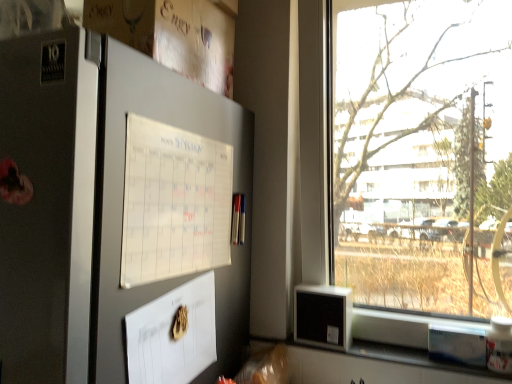
The image size is (512, 384). Describe the element at coordinates (423, 153) in the screenshot. I see `transparent glass window at right` at that location.

Based on the photo, measure the distance between white paper calendar at upper left and camera.

A distance of 27.89 inches exists between white paper calendar at upper left and camera.

The height and width of the screenshot is (384, 512). Describe the element at coordinates (174, 203) in the screenshot. I see `white paper calendar at upper left` at that location.

At what (x,y) coordinates should I click in order to perform the action: click on transparent glass window at right. Please return your answer as a coordinate pair (x, y). This screenshot has width=512, height=384. Looking at the image, I should click on (423, 153).

Would you say transparent glass window at right is outside white paper calendar at upper left?

That's correct, transparent glass window at right is outside of white paper calendar at upper left.

Is transparent glass window at right taller than white paper calendar at upper left?

Correct, transparent glass window at right is much taller as white paper calendar at upper left.

Visually, is transparent glass window at right positioned to the left or to the right of white paper calendar at upper left?

transparent glass window at right is positioned on white paper calendar at upper left's right side.

From the image's perspective, is transparent glass window at right on white paper calendar at upper left?

Correct, transparent glass window at right appears higher than white paper calendar at upper left in the image.

Identify the location of window that is behind the white paper calendar at upper left. (423, 153).

Is white paper calendar at upper left oriented towards transparent glass window at right?

No, white paper calendar at upper left is not aimed at transparent glass window at right.

Between white paper calendar at upper left and transparent glass window at right, which one has smaller width?

white paper calendar at upper left is thinner.

In the scene shown: Considering the relative positions of satin silver fridge at left and white paper calendar at upper left in the image provided, is satin silver fridge at left behind white paper calendar at upper left?

No, it is in front of white paper calendar at upper left.

Considering the sizes of objects satin silver fridge at left and white paper calendar at upper left in the image provided, who is bigger, satin silver fridge at left or white paper calendar at upper left?

satin silver fridge at left is bigger.

Are satin silver fridge at left and white paper calendar at upper left beside each other?

A: Yes, satin silver fridge at left is with white paper calendar at upper left.

From the image's perspective, between satin silver fridge at left and white paper calendar at upper left, who is located below?

satin silver fridge at left is shown below in the image.

Can you confirm if transparent glass window at right is bigger than satin silver fridge at left?

No.

What's the angular difference between transparent glass window at right and satin silver fridge at left's facing directions?

The facing directions of transparent glass window at right and satin silver fridge at left are 0.74 degrees apart.

Consider the image. Visually, is transparent glass window at right positioned to the left or to the right of satin silver fridge at left?

transparent glass window at right is to the right of satin silver fridge at left.

From a real-world perspective, who is located lower, transparent glass window at right or satin silver fridge at left?

satin silver fridge at left.

Considering the sizes of objects white paper calendar at upper left and satin silver fridge at left in the image provided, who is wider, white paper calendar at upper left or satin silver fridge at left?

With larger width is satin silver fridge at left.

From a real-world perspective, which is physically below, white paper calendar at upper left or satin silver fridge at left?

From a 3D spatial view, satin silver fridge at left is below.

Is white paper calendar at upper left shorter than satin silver fridge at left?

Yes.

Can you confirm if satin silver fridge at left is thinner than transparent glass window at right?

No.

Is the surface of satin silver fridge at left in direct contact with transparent glass window at right?

satin silver fridge at left and transparent glass window at right are clearly separated.

Does satin silver fridge at left come behind transparent glass window at right?

No, satin silver fridge at left is closer to the camera.

This screenshot has width=512, height=384. In the image, there is a white paper calendar at upper left. In order to click on window above it (from the image's perspective) in this screenshot , I will do `click(423, 153)`.

At what (x,y) coordinates should I click in order to perform the action: click on poster below the transparent glass window at right (from the image's perspective). Please return your answer as a coordinate pair (x, y). This screenshot has width=512, height=384. Looking at the image, I should click on (174, 203).

Based on their spatial positions, is transparent glass window at right or white paper calendar at upper left further from satin silver fridge at left?

transparent glass window at right is further to satin silver fridge at left.

Based on their spatial positions, is transparent glass window at right or satin silver fridge at left further from white paper calendar at upper left?

Among the two, transparent glass window at right is located further to white paper calendar at upper left.

When comparing their distances from transparent glass window at right, does white paper calendar at upper left or satin silver fridge at left seem further?

Among the two, satin silver fridge at left is located further to transparent glass window at right.

When comparing their distances from transparent glass window at right, does satin silver fridge at left or white paper calendar at upper left seem further?

satin silver fridge at left is further to transparent glass window at right.

Based on the photo, based on their spatial positions, is white paper calendar at upper left or transparent glass window at right further from satin silver fridge at left?

The object further to satin silver fridge at left is transparent glass window at right.

From the image, which object appears to be farther from white paper calendar at upper left, satin silver fridge at left or transparent glass window at right?

transparent glass window at right is further to white paper calendar at upper left.

Find the location of a particular element. This screenshot has width=512, height=384. poster located between satin silver fridge at left and transparent glass window at right in the left-right direction is located at coordinates (174, 203).